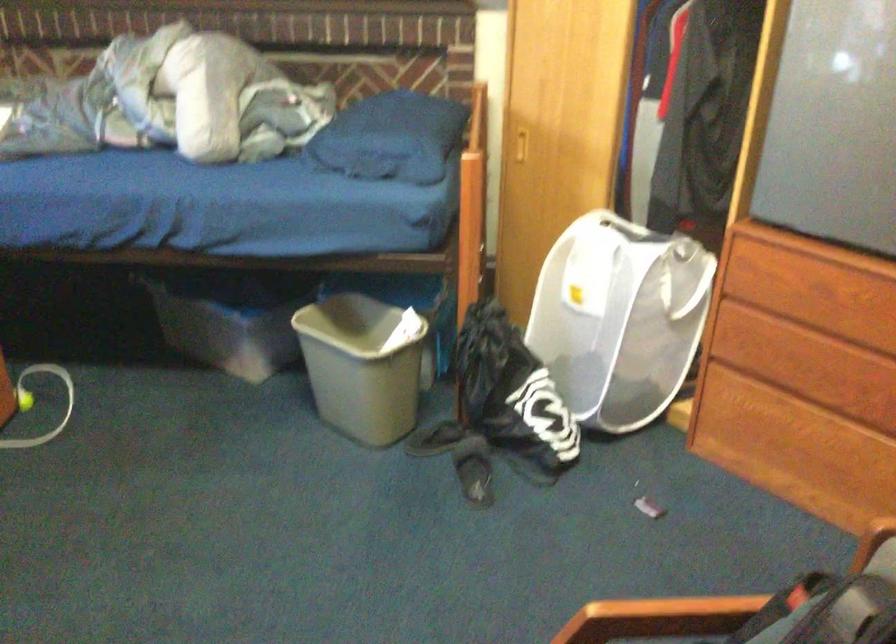
Where would you lift the trash can handle? Please return your answer as a coordinate pair (x, y).

(363, 365)